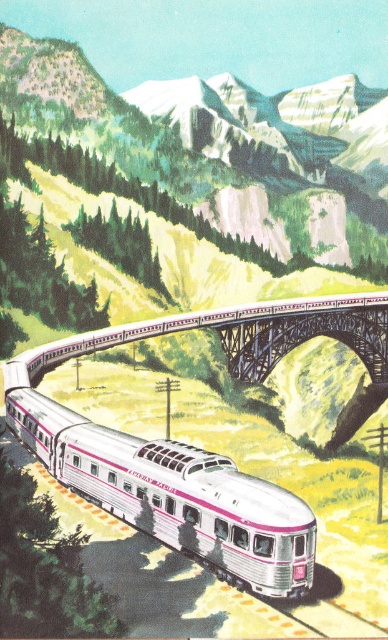
You are a passenger on the silver polished metal train at center and want to look out the window to see the metallic gray bridge at center. Which direction should you look to see the bridge?

The silver polished metal train at center is positioned under the metallic gray bridge at center, so you should look upward to see the metallic gray bridge at center.

You are a passenger on the silver polished metal train at center and want to know if there is enough space for your large luggage. The metallic gray bridge at center is part of the track you are currently on. Can you determine if your luggage will fit on the train without exceeding the available space on the bridge?

The silver polished metal train at center occupies less space than the metallic gray bridge at center, so the luggage should fit as the train is smaller and the bridge has more space.